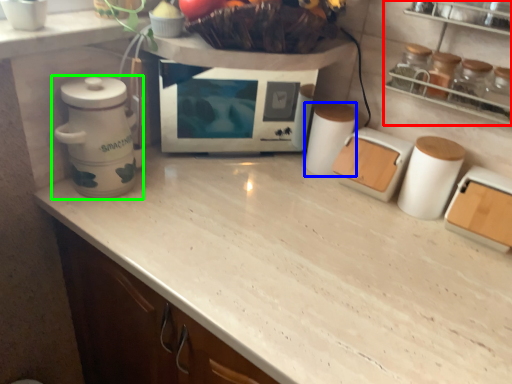
Question: Considering the real-world distances, which object is farthest from shelf (highlighted by a red box)? appliance (highlighted by a blue box) or home appliance (highlighted by a green box)?

Choices:
 (A) appliance
 (B) home appliance

Answer: (B)